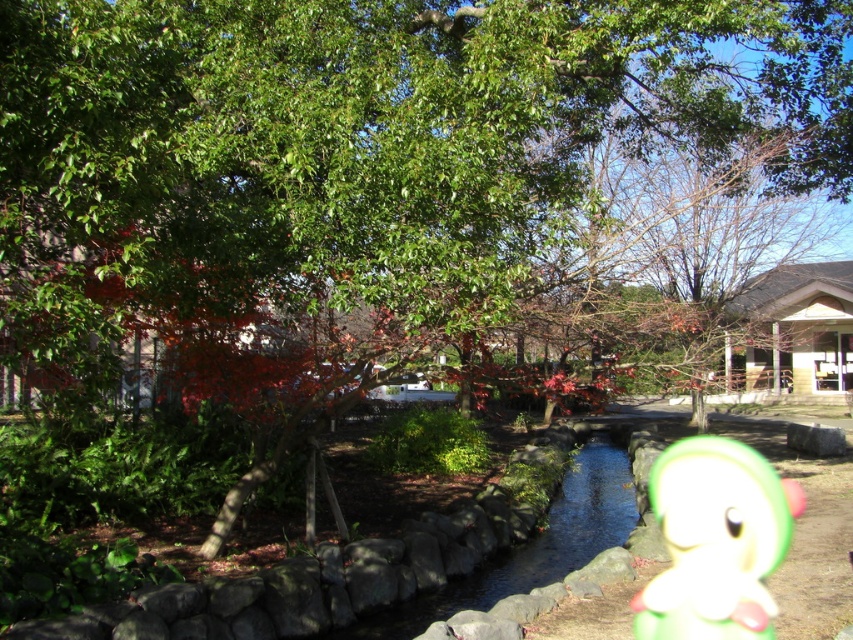
You are standing at the edge of the stream in the park scene and see the green matte plush toy at center. Based on its position, can you determine if it is closer to the water or the stone wall?

The green matte plush toy at center is located at point coordinates that are closer to the water than the stone wall, so it is near the water.

You are a child visiting the park and see the green matte plush toy at center and the smooth stone pond at center. Which object is located to the right side of the other?

The green matte plush toy at center is to the right of the smooth stone pond at center.

You are a child visiting the park and see the green matte plush toy at center and the smooth stone pond at center. Which object is closer to you?

The green matte plush toy at center is closer to the viewer than the smooth stone pond at center.